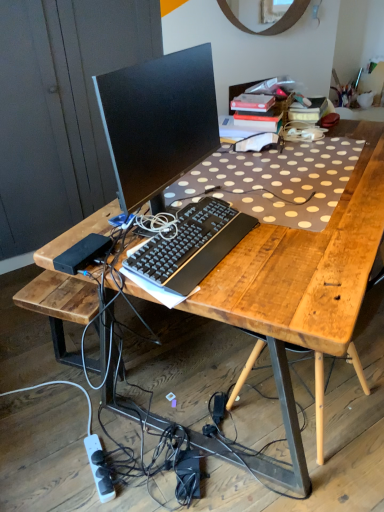
Question: Is black plastic keyboard at center positioned with its back to wooden at right?

Choices:
 (A) no
 (B) yes

Answer: (A)

Question: Is black plastic keyboard at center to the left of wooden at right from the viewer's perspective?

Choices:
 (A) yes
 (B) no

Answer: (A)

Question: Considering the relative sizes of black plastic keyboard at center and wooden at right in the image provided, is black plastic keyboard at center shorter than wooden at right?

Choices:
 (A) yes
 (B) no

Answer: (A)

Question: Is black plastic keyboard at center not close to wooden at right?

Choices:
 (A) no
 (B) yes

Answer: (A)

Question: Is wooden at right completely or partially inside black plastic keyboard at center?

Choices:
 (A) yes
 (B) no

Answer: (B)

Question: In the image, is wooden desk at center positioned in front of or behind wooden at right?

Choices:
 (A) front
 (B) behind

Answer: (A)

Question: Is wooden desk at center bigger or smaller than wooden at right?

Choices:
 (A) big
 (B) small

Answer: (A)

Question: From the image's perspective, is wooden desk at center above or below wooden at right?

Choices:
 (A) above
 (B) below

Answer: (A)

Question: Would you say wooden desk at center is inside or outside wooden at right?

Choices:
 (A) outside
 (B) inside

Answer: (A)

Question: From their relative heights in the image, would you say white plastic power strip at lower left is taller or shorter than wooden at right?

Choices:
 (A) tall
 (B) short

Answer: (B)

Question: Is white plastic power strip at lower left situated inside wooden at right or outside?

Choices:
 (A) outside
 (B) inside

Answer: (A)

Question: From a real-world perspective, is white plastic power strip at lower left above or below wooden at right?

Choices:
 (A) above
 (B) below

Answer: (B)

Question: Considering the positions of white plastic power strip at lower left and wooden at right in the image, is white plastic power strip at lower left bigger or smaller than wooden at right?

Choices:
 (A) big
 (B) small

Answer: (B)

Question: Is white plastic power strip at lower left in front of or behind wooden desk at center in the image?

Choices:
 (A) behind
 (B) front

Answer: (A)

Question: From a real-world perspective, is white plastic power strip at lower left above or below wooden desk at center?

Choices:
 (A) below
 (B) above

Answer: (A)